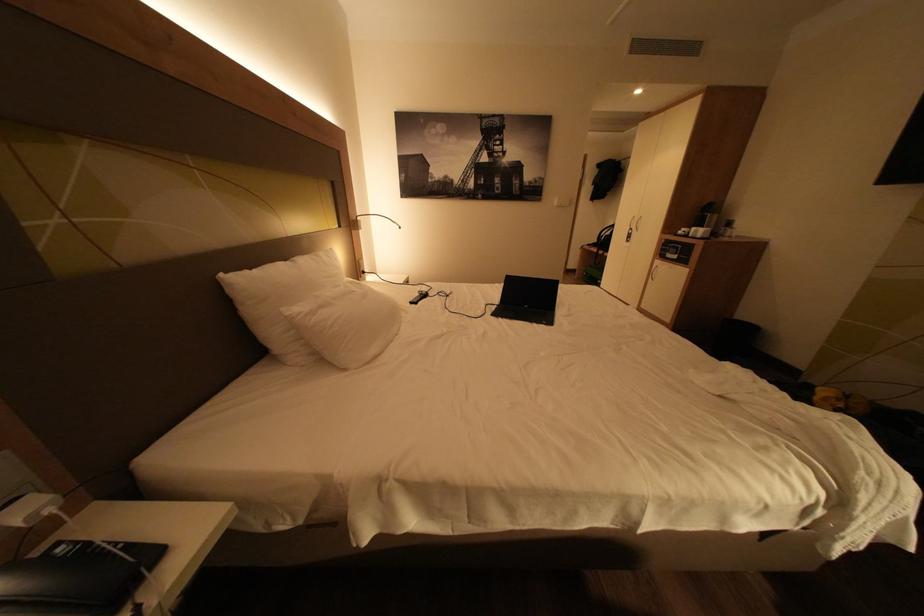
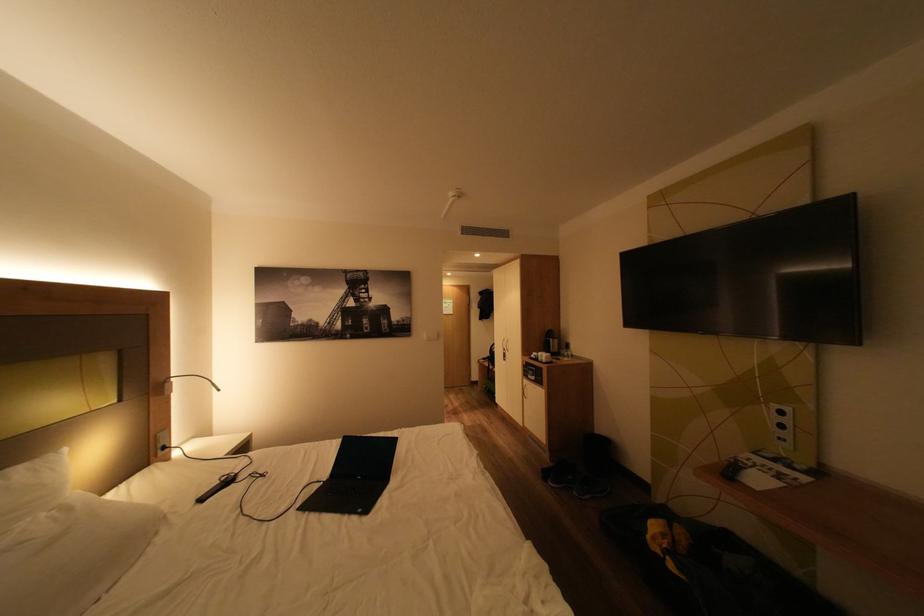
Locate, in the second image, the point that corresponds to point 503,305 in the first image.

(329, 483)